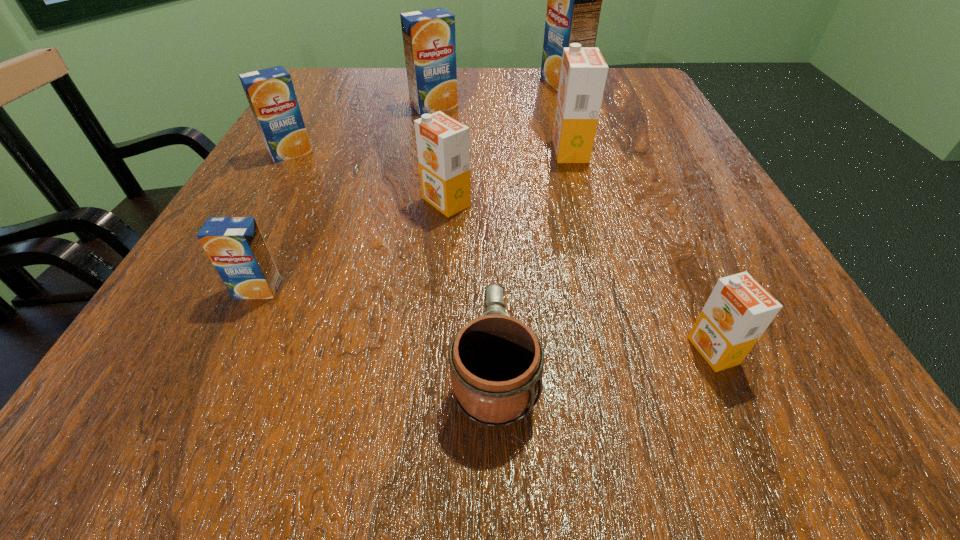
Find the location of a particular element. This screenshot has height=540, width=960. blank space at the near left corner of the desktop is located at coordinates tap(161, 419).

Locate an element on the screen. The width and height of the screenshot is (960, 540). free space at the far right corner of the desktop is located at coordinates (610, 78).

At what (x,y) coordinates should I click in order to perform the action: click on free space at the near right corner of the desktop. Please return your answer as a coordinate pair (x, y). The height and width of the screenshot is (540, 960). Looking at the image, I should click on (731, 403).

What are the coordinates of `free point between the nearest blue orange_juice and the biggest orange orange juice` in the screenshot? It's located at (415, 220).

Where is `free space between the third nearest orange juice and the nearest blue orange_juice`? The image size is (960, 540). free space between the third nearest orange juice and the nearest blue orange_juice is located at coordinates (352, 246).

Image resolution: width=960 pixels, height=540 pixels. I want to click on blank region between the tallest orange juice and the rightmost object, so click(638, 217).

Where is `blank region between the second farthest blue orange_juice and the biggest orange orange juice`? blank region between the second farthest blue orange_juice and the biggest orange orange juice is located at coordinates (502, 129).

This screenshot has height=540, width=960. What are the coordinates of `unoccupied position between the second nearest orange orange juice and the mug` in the screenshot? It's located at pos(470,287).

In order to click on vacant region between the second farthest object and the second nearest orange juice in this screenshot , I will do `click(347, 198)`.

I want to click on empty space between the sixth nearest orange juice and the farthest orange orange juice, so click(x=502, y=129).